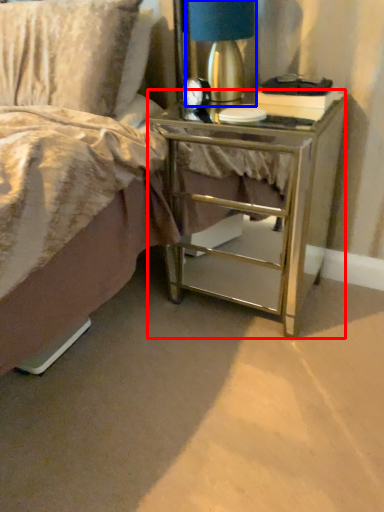
Question: Which of the following is the farthest to the observer, nightstand (highlighted by a red box) or bedside lamp (highlighted by a blue box)?

Choices:
 (A) nightstand
 (B) bedside lamp

Answer: (B)